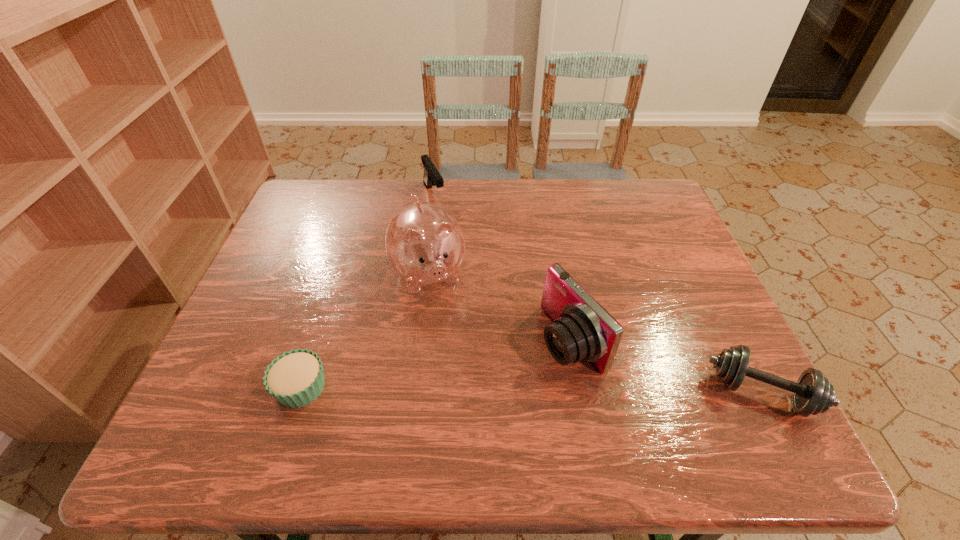
I want to click on free location located 0.190m on the front-facing side of the second object from right to left, so click(x=468, y=400).

Identify the location of vacant area situated on the front-facing side of the second object from right to left. Image resolution: width=960 pixels, height=540 pixels. (498, 384).

Locate an element on the screen. vacant region located on the front-facing side of the farthest object is located at coordinates (476, 275).

Find the location of a particular element. The image size is (960, 540). blank space located 0.320m on the front-facing side of the farthest object is located at coordinates [478, 277].

Where is `free space located 0.330m on the front-facing side of the farthest object`? Image resolution: width=960 pixels, height=540 pixels. free space located 0.330m on the front-facing side of the farthest object is located at coordinates (480, 280).

I want to click on vacant area located on the front facing side of the tallest object, so click(468, 392).

This screenshot has height=540, width=960. In order to click on vacant space located on the front facing side of the tallest object in this screenshot , I will do `click(449, 336)`.

At what (x,y) coordinates should I click in order to perform the action: click on blank space located 0.110m on the front facing side of the tallest object. Please return your answer as a coordinate pair (x, y). The width and height of the screenshot is (960, 540). Looking at the image, I should click on (450, 339).

At what (x,y) coordinates should I click in order to perform the action: click on object that is positioned at the far edge. Please return your answer as a coordinate pair (x, y). Looking at the image, I should click on (431, 177).

At what (x,y) coordinates should I click in order to perform the action: click on cupcake located at the near edge. Please return your answer as a coordinate pair (x, y). The image size is (960, 540). Looking at the image, I should click on (296, 378).